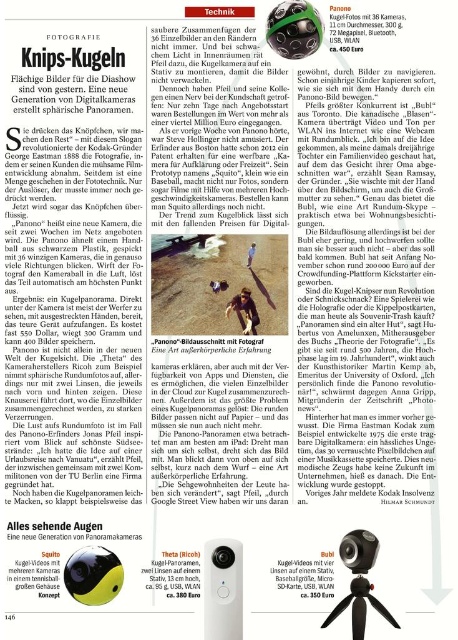
You are a photographer who wants to set up your equipment on the point marked as point [359,608]. Where should you place your black plastic tripod at lower center?

The black plastic tripod at lower center is located at point [359,608], so you should place your black plastic tripod at lower center exactly at that point.

You are a photographer trying to position two markers on the magazine page to indicate important points. The first marker should be placed at point [355,632] and the second at point [350,547]. From the reader perspective, which marker will appear closer to the front of the page?

The point at [355,632] will appear closer to the front of the page because it is in front of point [350,547] according to the spatial arrangement described.